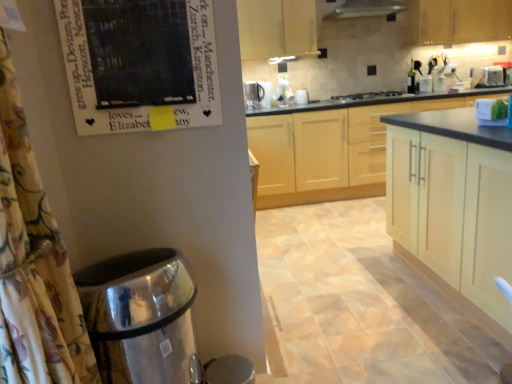
Question: Which direction should I rotate to look at light wood cabinet at upper center, which appears as the 2th cabinetry when viewed from the back, — up or down?

Choices:
 (A) down
 (B) up

Answer: (B)

Question: Is light wood cabinets at center, placed as the third cabinetry when sorted from back to front, smaller than black glass stove at center?

Choices:
 (A) no
 (B) yes

Answer: (A)

Question: From the image's perspective, would you say light wood cabinets at center, placed as the third cabinetry when sorted from back to front, is positioned over black glass stove at center?

Choices:
 (A) yes
 (B) no

Answer: (B)

Question: Can you confirm if light wood cabinets at center, placed as the third cabinetry when sorted from back to front, is bigger than black glass stove at center?

Choices:
 (A) no
 (B) yes

Answer: (B)

Question: Is light wood cabinets at center, which is the second cabinetry from front to back, taller than black glass stove at center?

Choices:
 (A) yes
 (B) no

Answer: (A)

Question: Is light wood cabinets at center, which is the second cabinetry from front to back, wider than black glass stove at center?

Choices:
 (A) no
 (B) yes

Answer: (B)

Question: Is black glass stove at center completely or partially inside light wood cabinets at center, which is the second cabinetry from front to back?

Choices:
 (A) yes
 (B) no

Answer: (B)

Question: Is black matte poster at upper left far away from light wood cabinets at center, which is the second cabinetry from front to back?

Choices:
 (A) no
 (B) yes

Answer: (B)

Question: Is black matte poster at upper left touching light wood cabinets at center, placed as the third cabinetry when sorted from back to front?

Choices:
 (A) no
 (B) yes

Answer: (A)

Question: From a real-world perspective, is black matte poster at upper left over light wood cabinets at center, placed as the third cabinetry when sorted from back to front?

Choices:
 (A) no
 (B) yes

Answer: (B)

Question: Does black matte poster at upper left have a lesser width compared to light wood cabinets at center, which is the second cabinetry from front to back?

Choices:
 (A) no
 (B) yes

Answer: (B)

Question: Is light wood cabinets at center, placed as the third cabinetry when sorted from back to front, located within black matte poster at upper left?

Choices:
 (A) no
 (B) yes

Answer: (A)

Question: Considering the relative sizes of black matte poster at upper left and light wood cabinets at center, which is the second cabinetry from front to back, in the image provided, is black matte poster at upper left wider than light wood cabinets at center, which is the second cabinetry from front to back,?

Choices:
 (A) yes
 (B) no

Answer: (B)

Question: Considering the relative positions of metallic silver mug at upper center and light wood cabinet at upper right, which is counted as the 1th cabinetry, starting from the back, in the image provided, is metallic silver mug at upper center behind light wood cabinet at upper right, which is counted as the 1th cabinetry, starting from the back,?

Choices:
 (A) yes
 (B) no

Answer: (A)